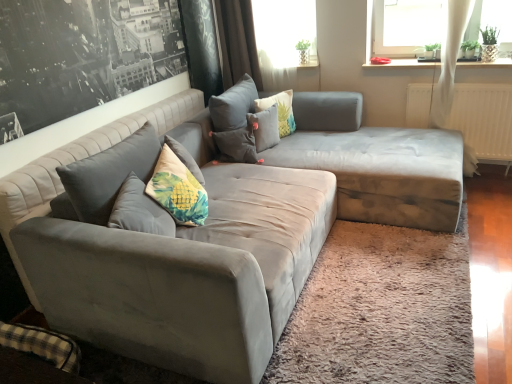
Question: Does floral fabric pillow at center, which is the 3th pillow in left-to-right order, appear on the left side of fluffy fabric pillow at center, the second pillow positioned from the right?

Choices:
 (A) no
 (B) yes

Answer: (A)

Question: Is floral fabric pillow at center, the 1th pillow from the right, shorter than fluffy fabric pillow at center, the second pillow positioned from the right?

Choices:
 (A) yes
 (B) no

Answer: (B)

Question: Is floral fabric pillow at center, which is the 3th pillow in left-to-right order, bigger than fluffy fabric pillow at center, the second pillow positioned from the right?

Choices:
 (A) yes
 (B) no

Answer: (A)

Question: From the image's perspective, would you say floral fabric pillow at center, the 1th pillow from the right, is positioned over fluffy fabric pillow at center, the second pillow positioned from the right?

Choices:
 (A) yes
 (B) no

Answer: (A)

Question: Is fluffy fabric pillow at center, placed as the second pillow when sorted from left to right, surrounded by floral fabric pillow at center, which is the 3th pillow in left-to-right order?

Choices:
 (A) no
 (B) yes

Answer: (A)

Question: From the image's perspective, is suede gray couch at center located above or below white sheer curtain at upper center?

Choices:
 (A) below
 (B) above

Answer: (A)

Question: Considering the positions of point (248, 79) and point (305, 24), is point (248, 79) closer or farther from the camera than point (305, 24)?

Choices:
 (A) farther
 (B) closer

Answer: (A)

Question: In terms of width, does suede gray couch at center look wider or thinner when compared to white sheer curtain at upper center?

Choices:
 (A) wide
 (B) thin

Answer: (A)

Question: In the image, is suede gray couch at center on the left side or the right side of white sheer curtain at upper center?

Choices:
 (A) left
 (B) right

Answer: (B)

Question: In terms of size, does fluffy fabric pillow at center, the second pillow positioned from the right, appear bigger or smaller than suede gray couch at center?

Choices:
 (A) small
 (B) big

Answer: (A)

Question: In terms of width, does fluffy fabric pillow at center, the second pillow positioned from the right, look wider or thinner when compared to suede gray couch at center?

Choices:
 (A) wide
 (B) thin

Answer: (B)

Question: From the image's perspective, is fluffy fabric pillow at center, placed as the second pillow when sorted from left to right, positioned above or below suede gray couch at center?

Choices:
 (A) above
 (B) below

Answer: (A)

Question: Is fluffy fabric pillow at center, placed as the second pillow when sorted from left to right, inside or outside of suede gray couch at center?

Choices:
 (A) inside
 (B) outside

Answer: (A)

Question: From a real-world perspective, is matte gray couch at upper left physically located above or below fluffy fabric pillow at center, placed as the second pillow when sorted from left to right?

Choices:
 (A) above
 (B) below

Answer: (A)

Question: Considering the positions of matte gray couch at upper left and fluffy fabric pillow at center, placed as the second pillow when sorted from left to right, in the image, is matte gray couch at upper left wider or thinner than fluffy fabric pillow at center, placed as the second pillow when sorted from left to right,?

Choices:
 (A) thin
 (B) wide

Answer: (A)